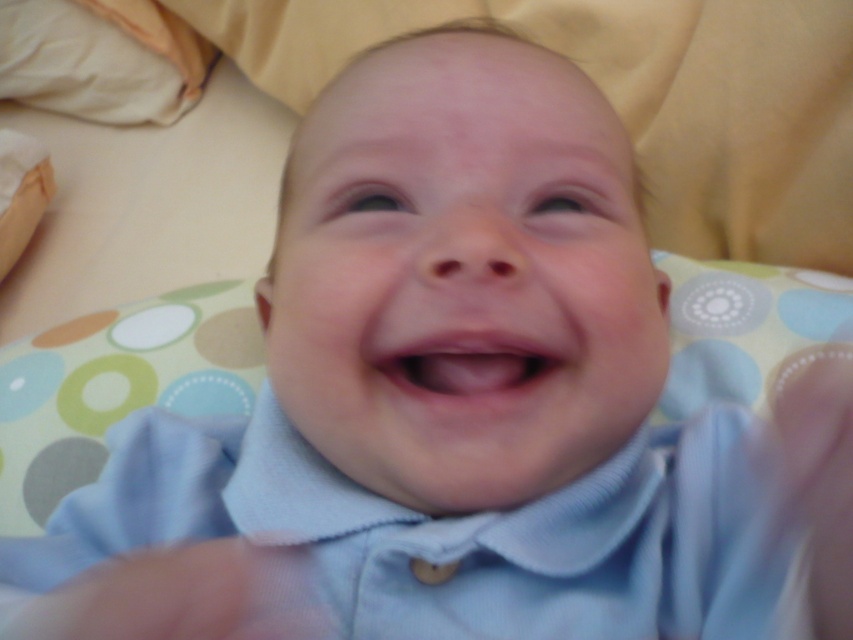
Question: Which of the following is the farthest from the observer?

Choices:
 (A) white soft pillow at upper left
 (B) light blue cotton shirt at center
 (C) pink smooth flesh at center

Answer: (A)

Question: Is light blue cotton shirt at center wider than pink smooth flesh at center?

Choices:
 (A) yes
 (B) no

Answer: (A)

Question: Among these objects, which one is nearest to the camera?

Choices:
 (A) white soft pillow at upper left
 (B) light blue cotton shirt at center
 (C) pink smooth flesh at center

Answer: (B)

Question: Does light blue cotton shirt at center appear on the left side of pink smooth flesh at center?

Choices:
 (A) no
 (B) yes

Answer: (B)

Question: Is light blue cotton shirt at center positioned in front of pink smooth flesh at center?

Choices:
 (A) no
 (B) yes

Answer: (B)

Question: Which point is closer to the camera?

Choices:
 (A) light blue cotton shirt at center
 (B) white soft pillow at upper left

Answer: (A)